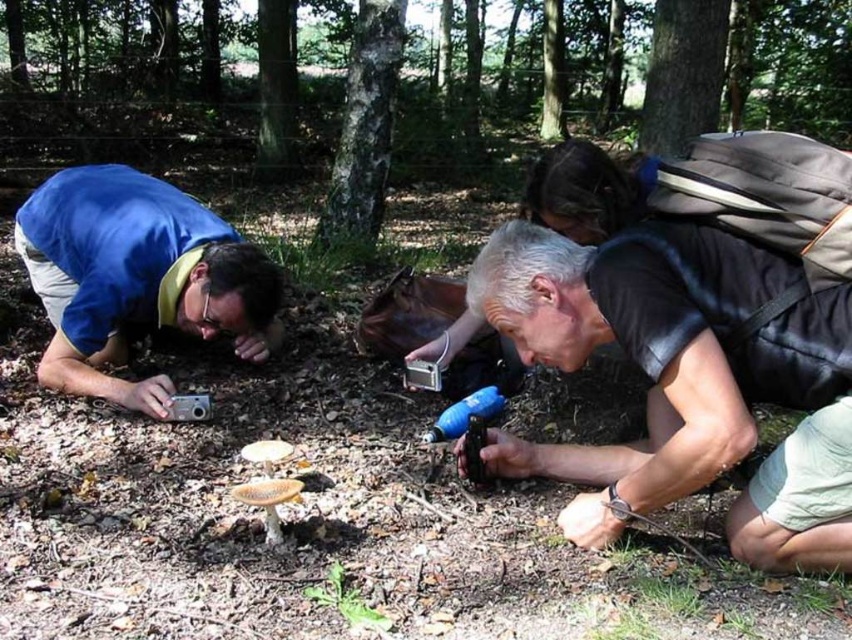
Between smooth bark tree at center and green leafy plant at center, which one has less height?

Standing shorter between the two is green leafy plant at center.

Which is in front, point (378, 164) or point (341, 580)?

Point (341, 580) is in front.

Where is `smooth bark tree at center`? The image size is (852, 640). smooth bark tree at center is located at coordinates (364, 131).

Is black matte camera at lower right positioned before matte blue shirt at lower left?

Yes, it is in front of matte blue shirt at lower left.

Is black matte camera at lower right shorter than matte blue shirt at lower left?

Yes.

Between point (769, 497) and point (29, 260), which one is positioned behind?

Point (29, 260)

Locate an element on the screen. Image resolution: width=852 pixels, height=640 pixels. black matte camera at lower right is located at coordinates (684, 380).

Can you confirm if matte blue shirt at lower left is bigger than smooth bark tree at center?

Incorrect, matte blue shirt at lower left is not larger than smooth bark tree at center.

Between matte blue shirt at lower left and smooth bark tree at center, which one is positioned lower?

matte blue shirt at lower left is below.

Between point (268, 307) and point (367, 68), which one is positioned behind?

Point (367, 68)

Where is `matte blue shirt at lower left`? matte blue shirt at lower left is located at coordinates (137, 278).